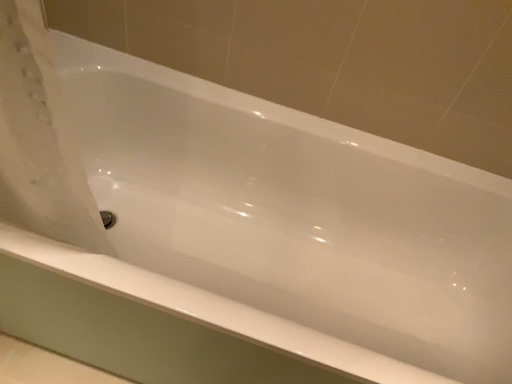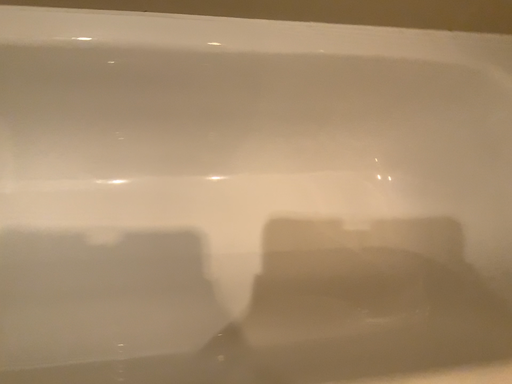
Question: How did the camera likely rotate when shooting the video?

Choices:
 (A) rotated downward
 (B) rotated upward

Answer: (A)